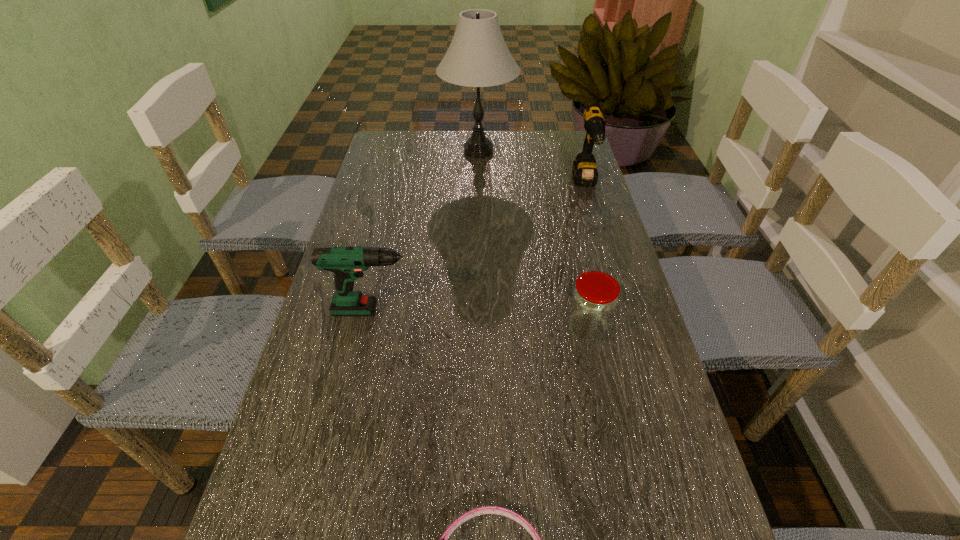
At what (x,y) coordinates should I click in order to perform the action: click on object that is at the far edge. Please return your answer as a coordinate pair (x, y). This screenshot has width=960, height=540. Looking at the image, I should click on (478, 56).

You are a GUI agent. You are given a task and a screenshot of the screen. Output one action in this format:
    pyautogui.click(x=<x>, y=<y>)
    Task: Click on the object present at the left edge
    The height and width of the screenshot is (540, 960).
    Given the screenshot: What is the action you would take?
    pos(347,263)

You are a GUI agent. You are given a task and a screenshot of the screen. Output one action in this format:
    pyautogui.click(x=<x>, y=<y>)
    Task: Click on the drill that is at the right edge
    
    Given the screenshot: What is the action you would take?
    pyautogui.click(x=584, y=170)

Image resolution: width=960 pixels, height=540 pixels. I want to click on jar located in the right edge section of the desktop, so click(594, 299).

In the image, there is a desktop. Where is `vacant space at the far edge`? vacant space at the far edge is located at coordinates (425, 159).

In the image, there is a desktop. What are the coordinates of `vacant space at the left edge` in the screenshot? It's located at (332, 447).

Locate an element on the screen. vacant space at the right edge is located at coordinates (615, 266).

Find the location of a particular element. vacant space at the far left corner is located at coordinates (421, 139).

Locate an element on the screen. The image size is (960, 540). free space between the left drill and the lamp is located at coordinates (429, 231).

Locate an element on the screen. The image size is (960, 540). vacant area between the fourth object from left to right and the rightmost object is located at coordinates (586, 255).